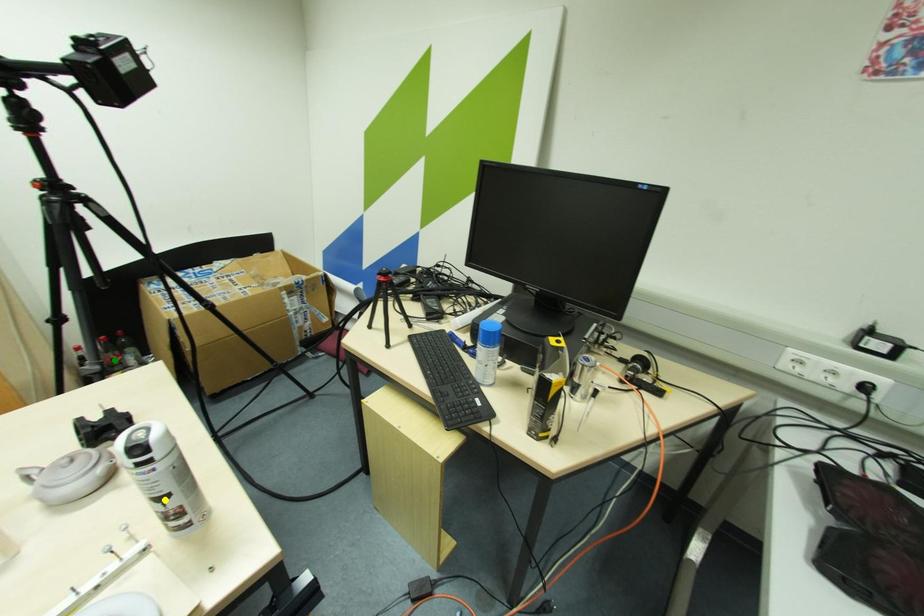
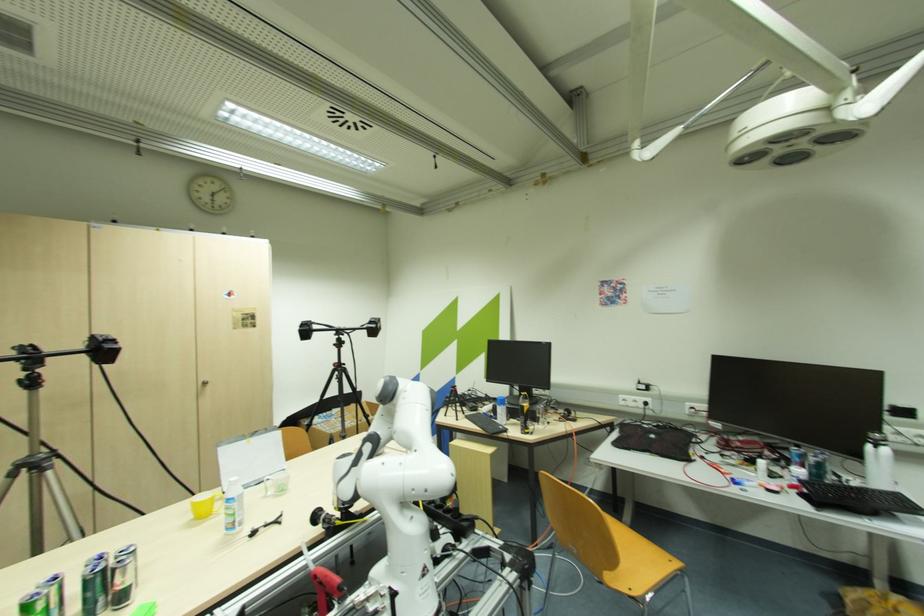
I am providing you with two images of the same scene from different viewpoints. Three points are marked in image1. Which point corresponds to a part or object that is occluded in image2?In image1, three points are marked. Which of them correspond to a part or object that is occluded in image2?Among the three points shown in image1, which one corresponds to a part or object that is no longer visible due to occlusion in image2?

blue point, yellow point, green point cannot be seen in image2.